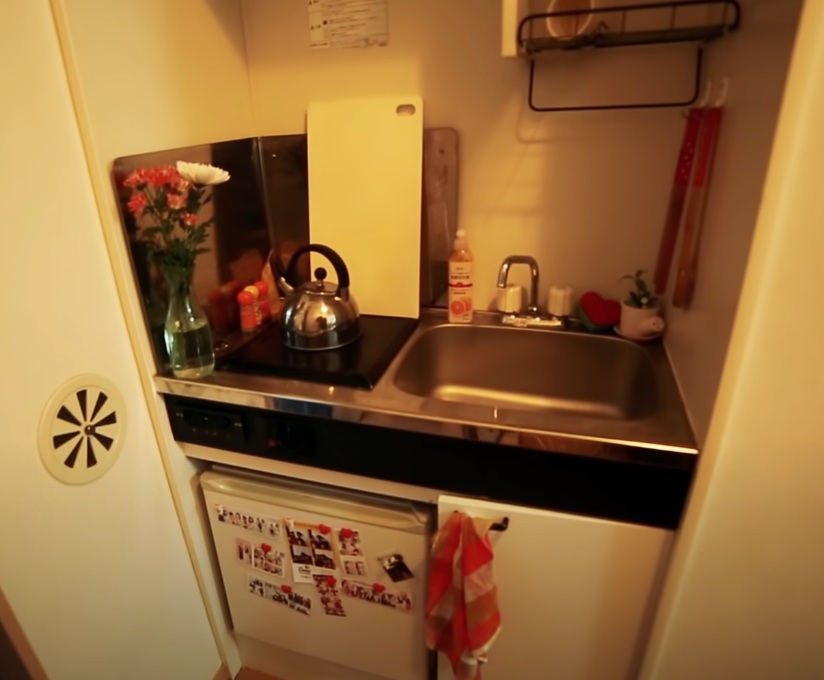
Where is `edge of floor`? The width and height of the screenshot is (824, 680). edge of floor is located at coordinates (246, 670).